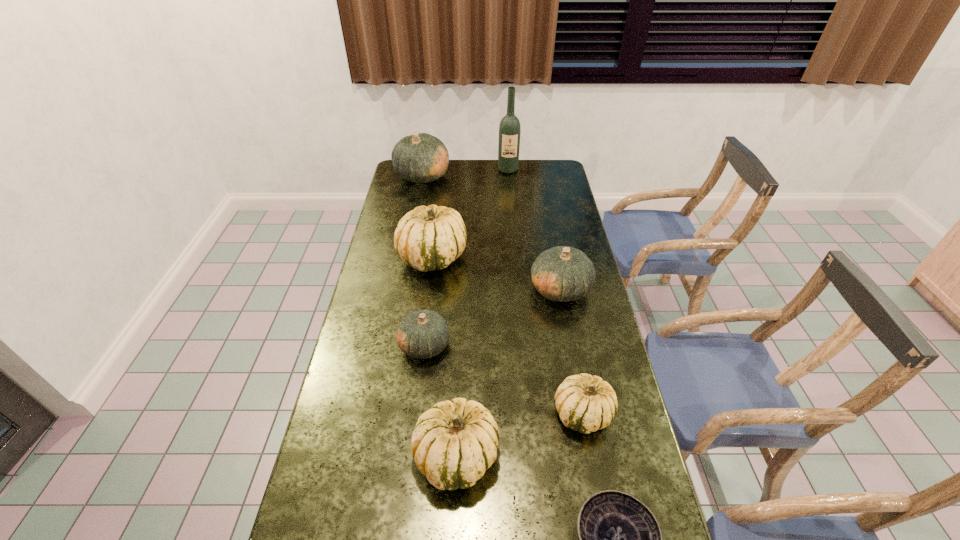
Image resolution: width=960 pixels, height=540 pixels. Identify the location of free location that satisfies the following two spatial constraints: 1. on the labeled side of the rightmost white gourd; 2. on the left side of the green wine bottle. (530, 414).